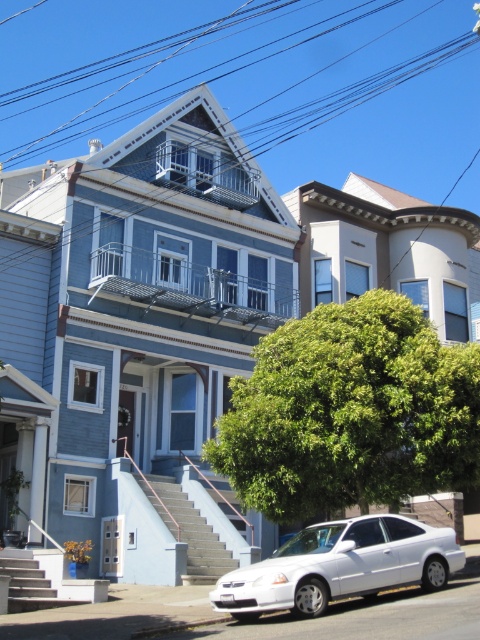
Which is behind, point (68, 13) or point (356, 579)?

Positioned behind is point (68, 13).

Which is more to the left, black wire at upper center or white glossy sedan at center?

Positioned to the left is black wire at upper center.

Between point (302, 3) and point (347, 554), which one is positioned behind?

Positioned behind is point (302, 3).

Where is `black wire at upper center`? black wire at upper center is located at coordinates (252, 81).

Does concrete stairs at center lie behind smooth concrete stairs at lower left?

Yes, concrete stairs at center is further from the viewer.

Is point (152, 476) farther from viewer compared to point (17, 568)?

Yes, it is.

You are a GUI agent. You are given a task and a screenshot of the screen. Output one action in this format:
    pyautogui.click(x=<x>, y=<y>)
    Task: Click on the concrete stairs at center
    The height and width of the screenshot is (640, 480).
    Given the screenshot: What is the action you would take?
    pyautogui.click(x=193, y=534)

Does black wire at upper center appear on the right side of concrete stairs at center?

Correct, you'll find black wire at upper center to the right of concrete stairs at center.

Which is below, black wire at upper center or concrete stairs at center?

concrete stairs at center is below.

Is point (319, 109) in front of point (191, 545)?

No.

At what (x,y) coordinates should I click in order to perform the action: click on black wire at upper center. Please return your answer as a coordinate pair (x, y). The height and width of the screenshot is (640, 480). Looking at the image, I should click on (252, 81).